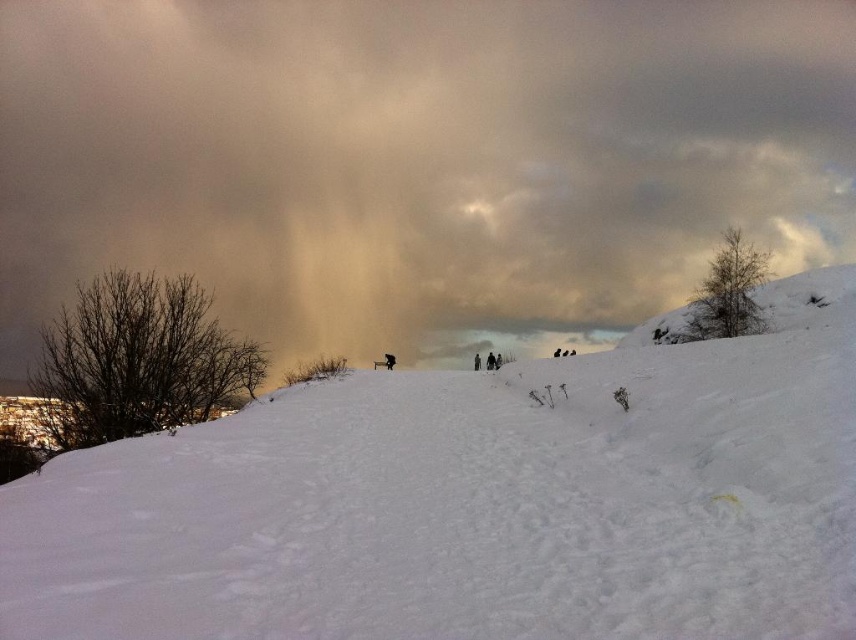
Which is behind, point (396, 349) or point (681, 545)?

Positioned behind is point (396, 349).

Is cloudy sky at upper center below white fluffy snow at center?

Incorrect, cloudy sky at upper center is not positioned below white fluffy snow at center.

Does point (375, 77) come closer to viewer compared to point (648, 486)?

No, it is behind (648, 486).

Where is `cloudy sky at upper center`? This screenshot has width=856, height=640. cloudy sky at upper center is located at coordinates (417, 160).